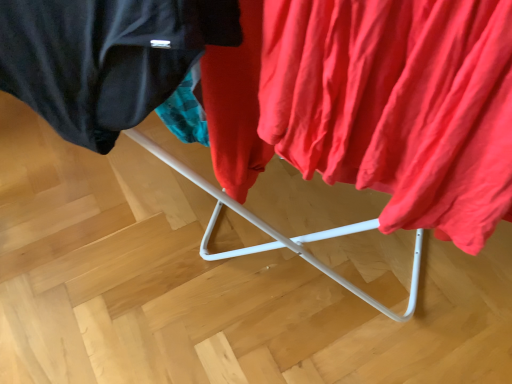
Question: Is matte red fabric at right far from matte black jacket at upper left?

Choices:
 (A) yes
 (B) no

Answer: (B)

Question: Does matte red fabric at right have a larger size compared to matte black jacket at upper left?

Choices:
 (A) no
 (B) yes

Answer: (B)

Question: Is matte red fabric at right further to the viewer compared to matte black jacket at upper left?

Choices:
 (A) no
 (B) yes

Answer: (A)

Question: From a real-world perspective, is matte red fabric at right on top of matte black jacket at upper left?

Choices:
 (A) no
 (B) yes

Answer: (B)

Question: Is matte red fabric at right facing away from matte black jacket at upper left?

Choices:
 (A) yes
 (B) no

Answer: (B)

Question: Is matte red fabric at right wider than matte black jacket at upper left?

Choices:
 (A) yes
 (B) no

Answer: (A)

Question: Is matte black jacket at upper left far from matte red fabric at right?

Choices:
 (A) no
 (B) yes

Answer: (A)

Question: Is matte black jacket at upper left to the left of matte red fabric at right from the viewer's perspective?

Choices:
 (A) no
 (B) yes

Answer: (B)

Question: From a real-world perspective, is matte black jacket at upper left below matte red fabric at right?

Choices:
 (A) no
 (B) yes

Answer: (B)

Question: Is matte black jacket at upper left aimed at matte red fabric at right?

Choices:
 (A) yes
 (B) no

Answer: (B)

Question: Is matte black jacket at upper left positioned with its back to matte red fabric at right?

Choices:
 (A) yes
 (B) no

Answer: (B)

Question: Is matte black jacket at upper left in contact with matte red fabric at right?

Choices:
 (A) no
 (B) yes

Answer: (A)

Question: Considering the positions of matte black jacket at upper left and matte red fabric at right in the image, is matte black jacket at upper left bigger or smaller than matte red fabric at right?

Choices:
 (A) small
 (B) big

Answer: (A)